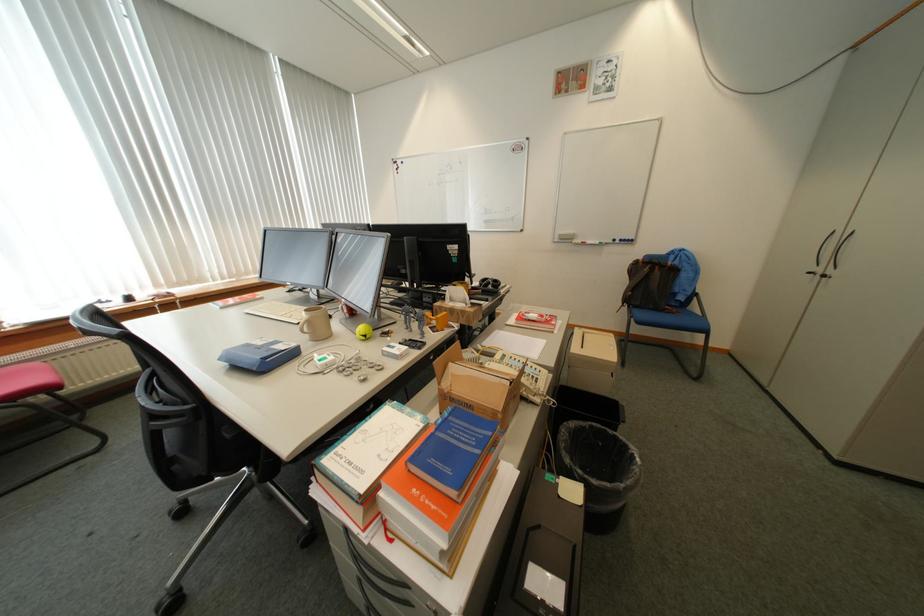
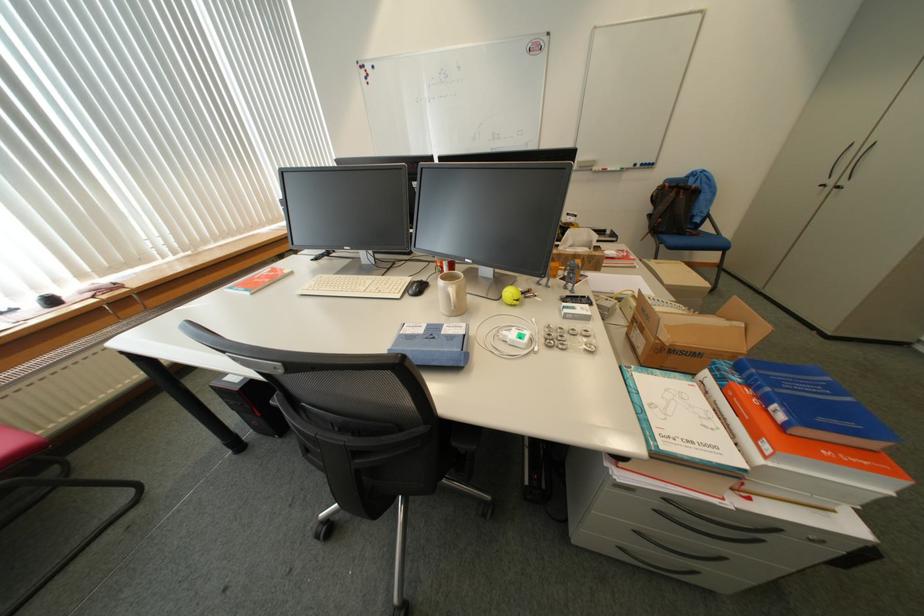
Where in the second image is the point corresponding to the point at 311,333 from the first image?

(465, 309)